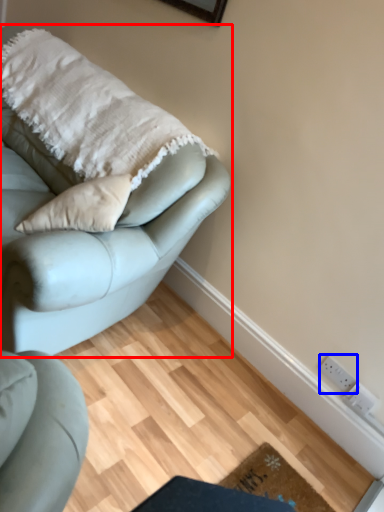
Question: Which point is further to the camera, studio couch (highlighted by a red box) or electric outlet (highlighted by a blue box)?

Choices:
 (A) studio couch
 (B) electric outlet

Answer: (B)